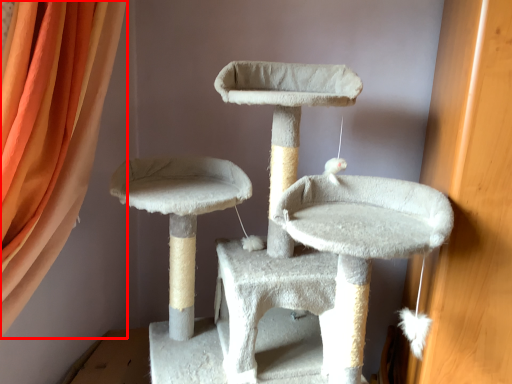
Question: From the image's perspective, where is curtain (annotated by the red box) located relative to cat furniture?

Choices:
 (A) below
 (B) above

Answer: (B)